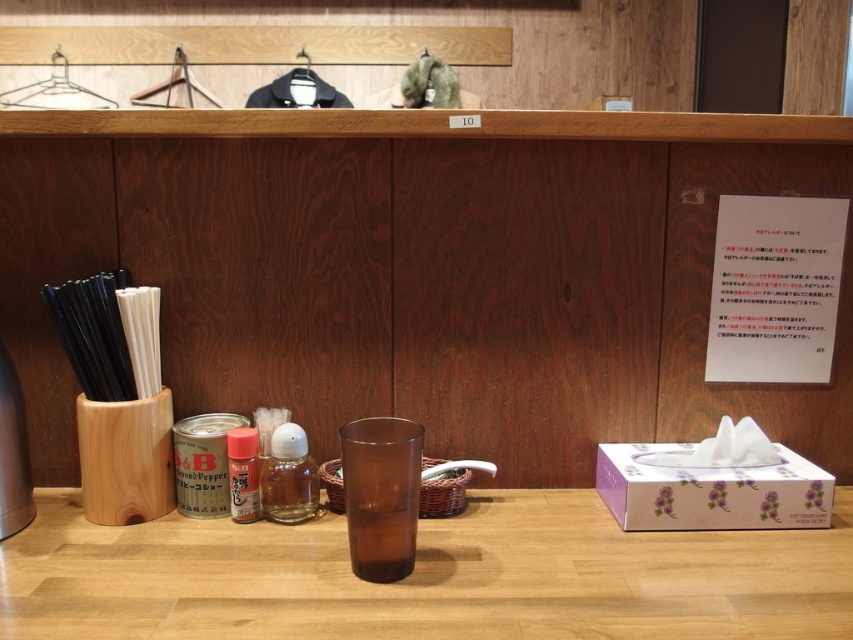
Does point (482, 524) lie in front of point (271, 490)?

Yes.

Is brown wood table at center below translucent glass bottle at center?

Yes, brown wood table at center is below translucent glass bottle at center.

Describe the element at coordinates (425, 577) in the screenshot. The image size is (853, 640). I see `brown wood table at center` at that location.

Where is `brown wood table at center`? This screenshot has height=640, width=853. brown wood table at center is located at coordinates (425, 577).

Describe the element at coordinates (425, 577) in the screenshot. I see `brown wood table at center` at that location.

Is point (154, 577) closer to viewer compared to point (225, 436)?

Yes, it is.

Locate an element on the screen. brown wood table at center is located at coordinates (425, 577).

Is purple floral tissue box at right to the right of translucent glass bottle at center from the viewer's perspective?

Indeed, purple floral tissue box at right is positioned on the right side of translucent glass bottle at center.

Does point (824, 477) come closer to viewer compared to point (281, 476)?

Yes, it is.

Looking at this image, who is more distant from viewer, (723,524) or (281,428)?

Positioned behind is point (281,428).

The image size is (853, 640). I want to click on purple floral tissue box at right, so click(x=711, y=492).